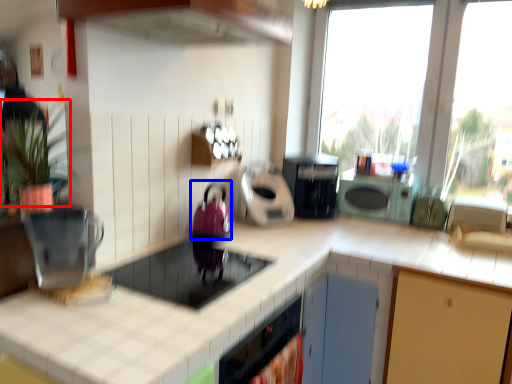
Question: Which object appears farthest to the camera in this image, plant (highlighted by a red box) or appliance (highlighted by a blue box)?

Choices:
 (A) plant
 (B) appliance

Answer: (B)